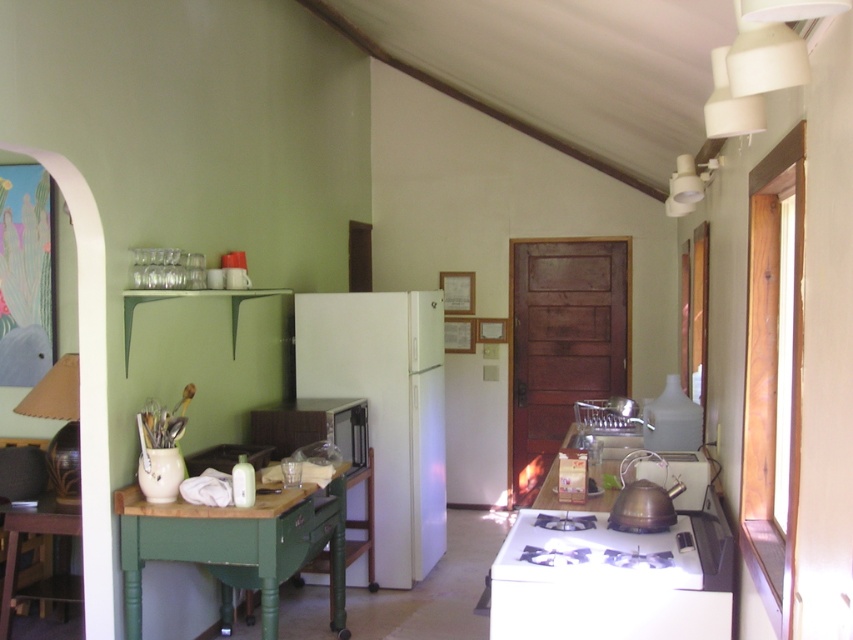
You are a chef preparing to cook a meal in this kitchen. You need to use the white glossy stove at lower center and the matte black microwave at center. Which appliance will you reach first if you are standing in front of the table?

The white glossy stove at lower center will be reached first because it is positioned in front of the matte black microwave at center, making it closer to your current position near the table.

You are organizing the kitchen and need to place a tall vase that requires a higher surface. Which object between the green painted wood table at left and the green wood table at lower left would be suitable for placing the vase?

The green painted wood table at left has a greater height compared to the green wood table at lower left, so it is suitable for placing the tall vase.

You are standing in the kitchen and want to reach both the point at coordinates point (292, 492) and point (10, 600). Which point should you target first to minimize the distance you need to move?

You should target point (292, 492) first because it is closer to you than point (10, 600).